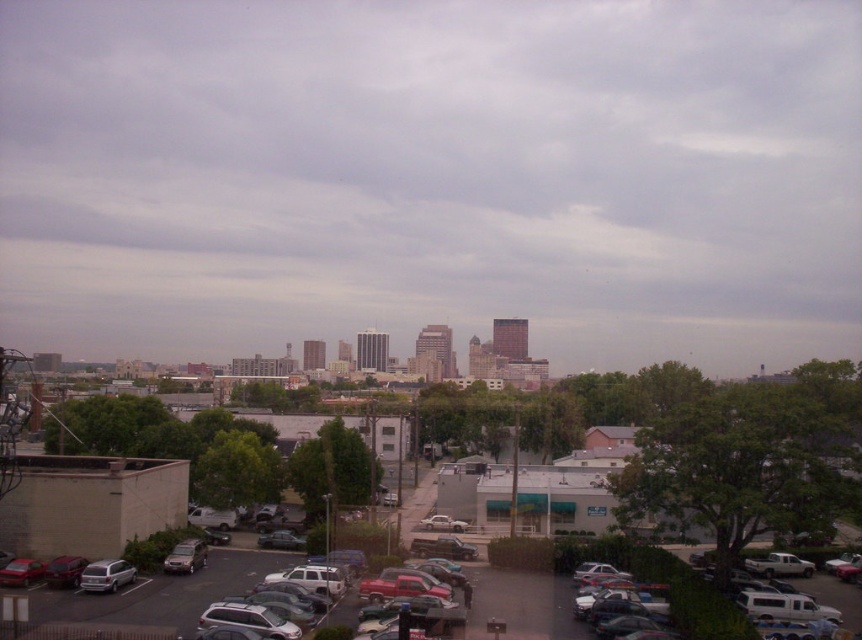
You are standing in the parking lot and see the metallic silver cars at lower center and the metallic silver sedan at center. Which one is positioned to the right of the other?

The metallic silver cars at lower center is positioned to the right of the metallic silver sedan at center.